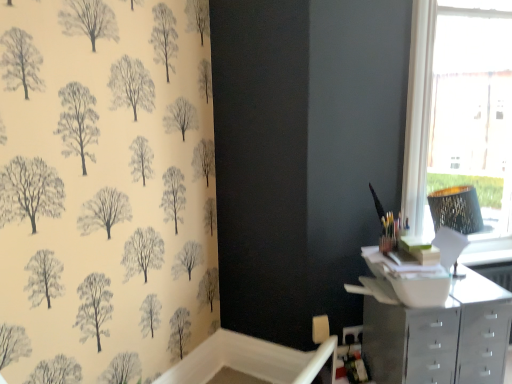
Question: Is white frame at upper right in front of metallic silver chest of drawers at lower right?

Choices:
 (A) yes
 (B) no

Answer: (B)

Question: From the image's perspective, is white frame at upper right under metallic silver chest of drawers at lower right?

Choices:
 (A) no
 (B) yes

Answer: (A)

Question: Can you confirm if white frame at upper right is thinner than metallic silver chest of drawers at lower right?

Choices:
 (A) no
 (B) yes

Answer: (B)

Question: Is white frame at upper right with metallic silver chest of drawers at lower right?

Choices:
 (A) yes
 (B) no

Answer: (B)

Question: Would you consider white frame at upper right to be distant from metallic silver chest of drawers at lower right?

Choices:
 (A) yes
 (B) no

Answer: (B)

Question: From the image's perspective, is white frame at upper right on metallic silver chest of drawers at lower right?

Choices:
 (A) yes
 (B) no

Answer: (A)

Question: Is white frame at upper right shorter than metallic mosaic lampshade at right?

Choices:
 (A) no
 (B) yes

Answer: (A)

Question: From a real-world perspective, is white frame at upper right under metallic mosaic lampshade at right?

Choices:
 (A) no
 (B) yes

Answer: (A)

Question: Is white frame at upper right not near metallic mosaic lampshade at right?

Choices:
 (A) yes
 (B) no

Answer: (B)

Question: Considering the relative positions of white frame at upper right and metallic mosaic lampshade at right in the image provided, is white frame at upper right behind metallic mosaic lampshade at right?

Choices:
 (A) no
 (B) yes

Answer: (B)

Question: Does white frame at upper right have a smaller size compared to metallic mosaic lampshade at right?

Choices:
 (A) yes
 (B) no

Answer: (B)

Question: Does white frame at upper right appear on the left side of metallic mosaic lampshade at right?

Choices:
 (A) no
 (B) yes

Answer: (A)

Question: From a real-world perspective, is metallic silver chest of drawers at lower right below white frame at upper right?

Choices:
 (A) no
 (B) yes

Answer: (B)